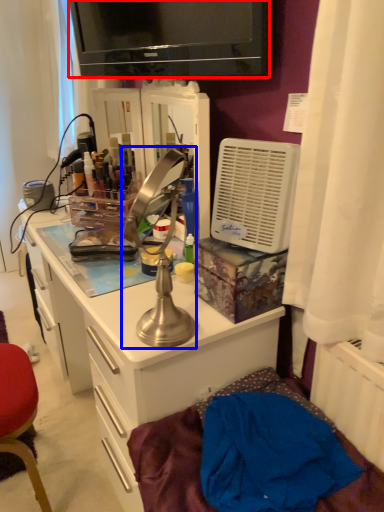
Question: Which object appears closest to the camera in this image, television (highlighted by a red box) or table lamp (highlighted by a blue box)?

Choices:
 (A) television
 (B) table lamp

Answer: (B)